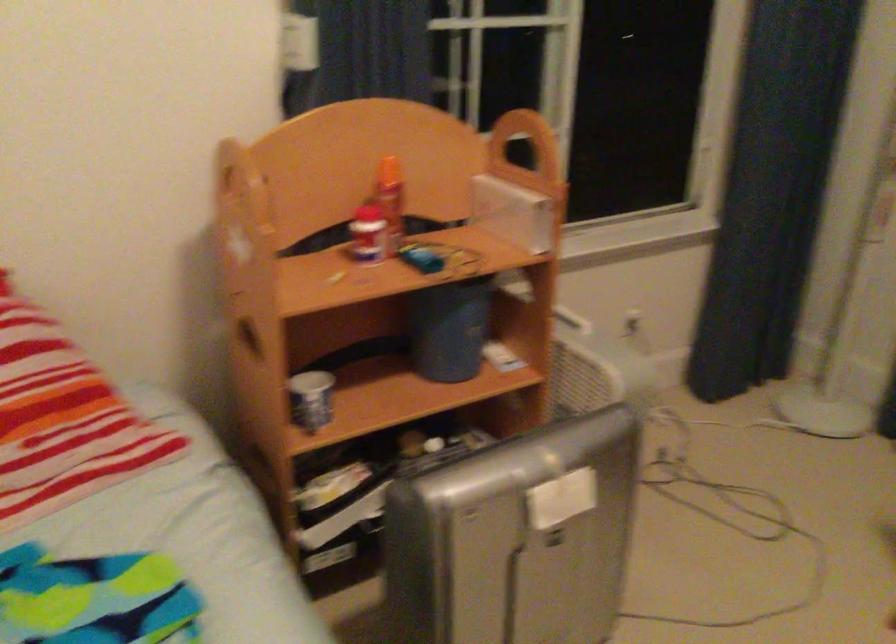
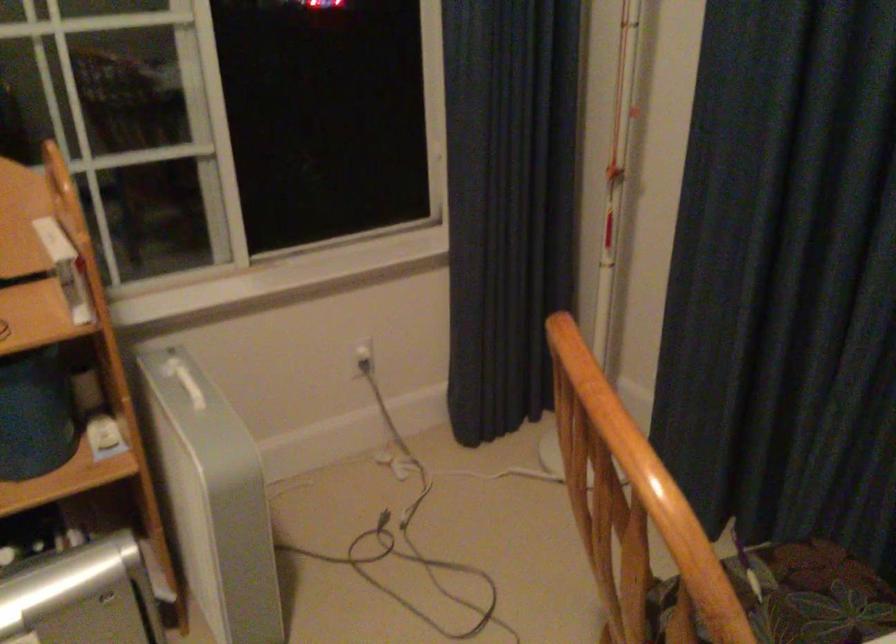
Which direction would the cameraman need to move to produce the second image?

The movement direction of the cameraman is right, forward.